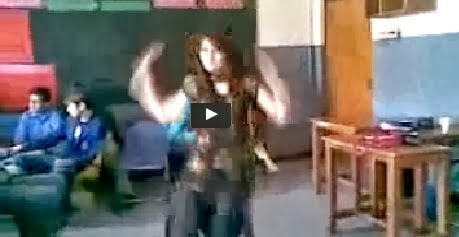
Identify the location of table legs. The image size is (459, 237). (315, 155), (356, 168), (332, 194), (392, 201), (376, 180), (422, 187), (445, 205).